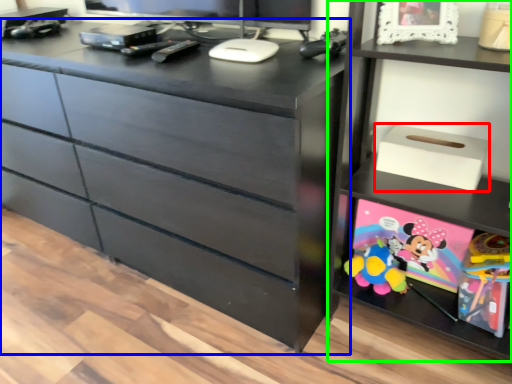
Question: Which object is the closest to the storage box (highlighted by a red box)? Choose among these: chest of drawers (highlighted by a blue box) or shelf (highlighted by a green box).

Choices:
 (A) chest of drawers
 (B) shelf

Answer: (B)